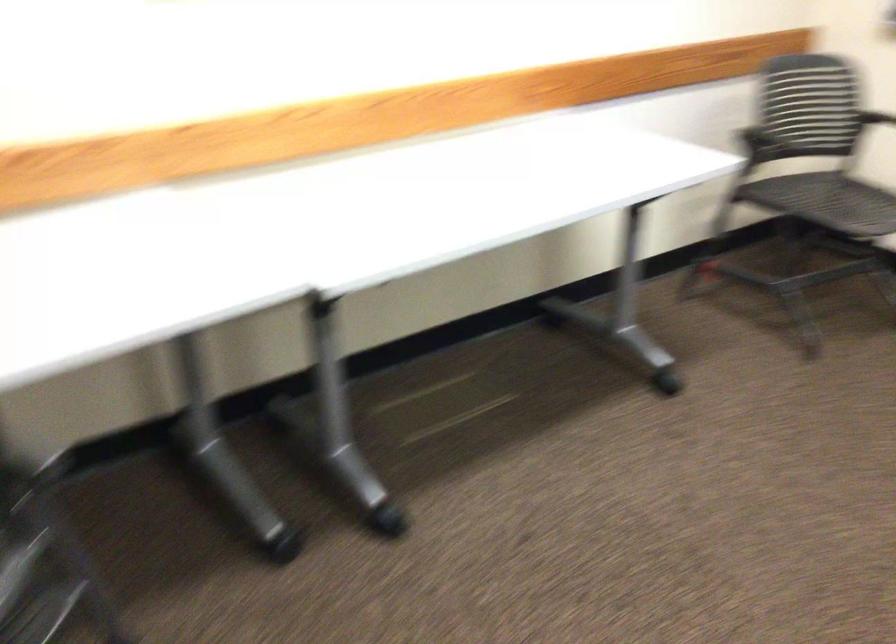
Describe the element at coordinates (825, 202) in the screenshot. Image resolution: width=896 pixels, height=644 pixels. I see `a black chair sitting surface` at that location.